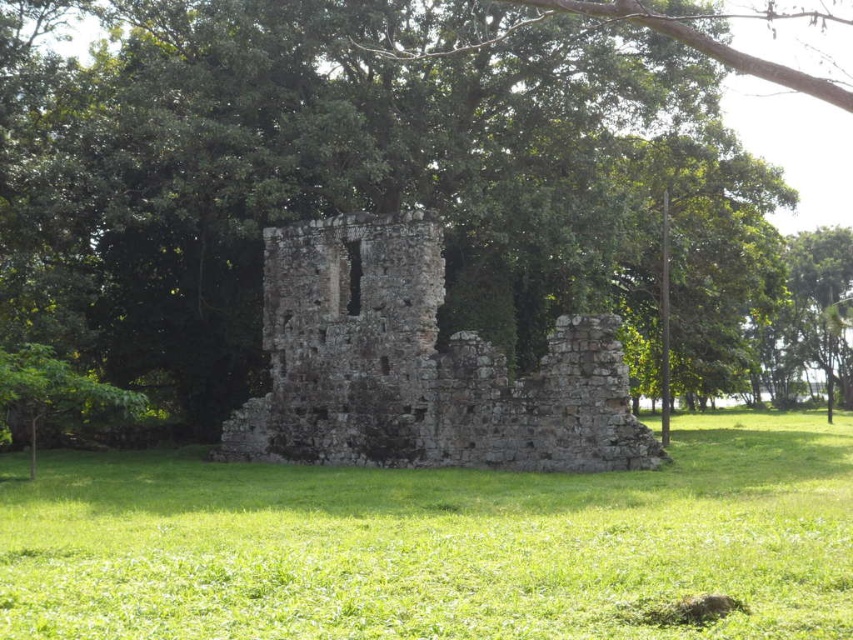
Question: Which point is farther from the camera taking this photo?

Choices:
 (A) (405, 394)
 (B) (618, 157)

Answer: (B)

Question: Does green grass at center appear on the left side of rustic stone castle at center?

Choices:
 (A) no
 (B) yes

Answer: (B)

Question: Which point is farther from the camera taking this photo?

Choices:
 (A) (354, 292)
 (B) (257, 301)
 (C) (589, 480)

Answer: (B)

Question: Does green leafy tree at center appear over green grass at center?

Choices:
 (A) yes
 (B) no

Answer: (A)

Question: Which of the following is the farthest from the observer?

Choices:
 (A) green grass at center
 (B) green leafy tree at center

Answer: (B)

Question: Does green grass at center have a larger size compared to rustic stone castle at center?

Choices:
 (A) yes
 (B) no

Answer: (B)